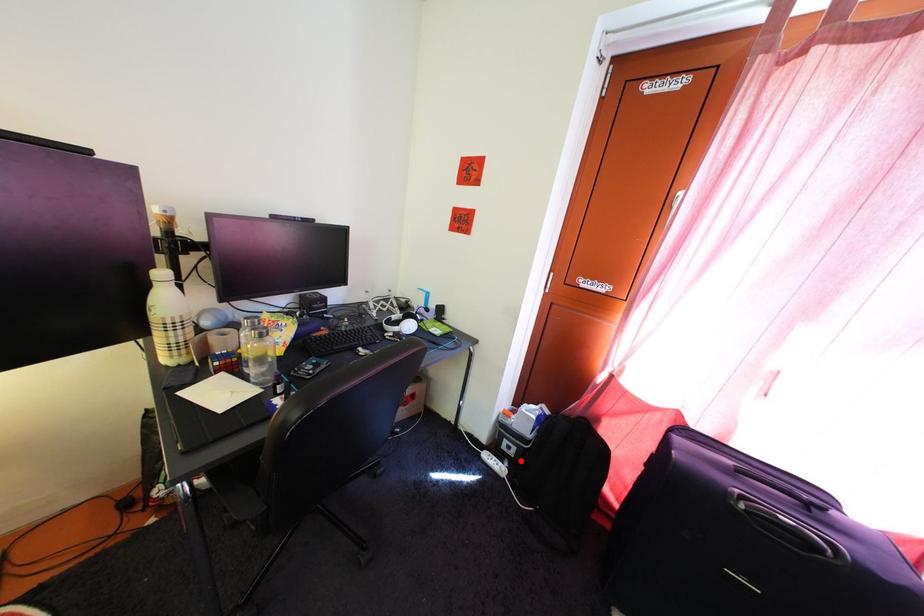
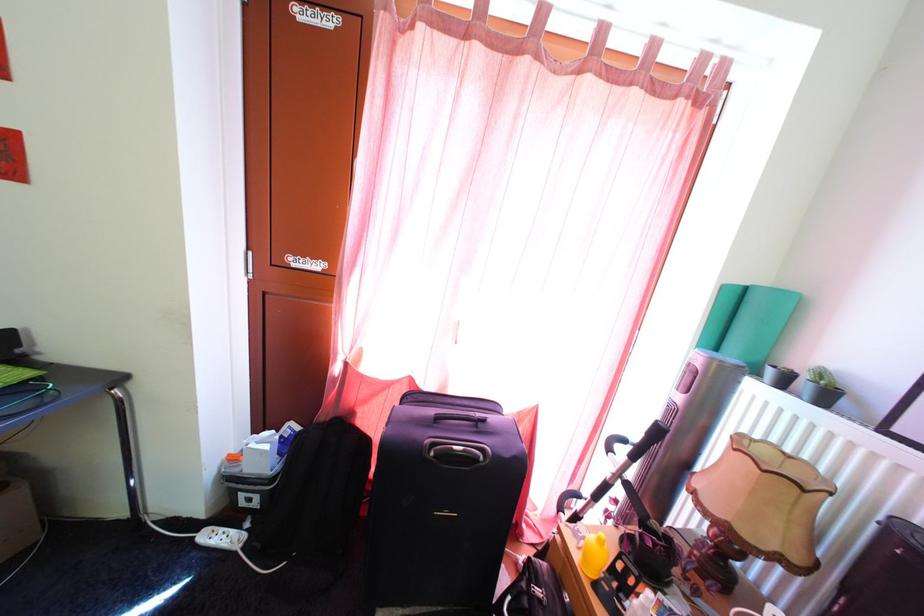
Question: I am providing you with two images of the same scene from different viewpoints. A red point is marked on the first image. At the location where the point appears in image 1, is it still visible in image 2?

Choices:
 (A) Yes
 (B) No

Answer: (A)